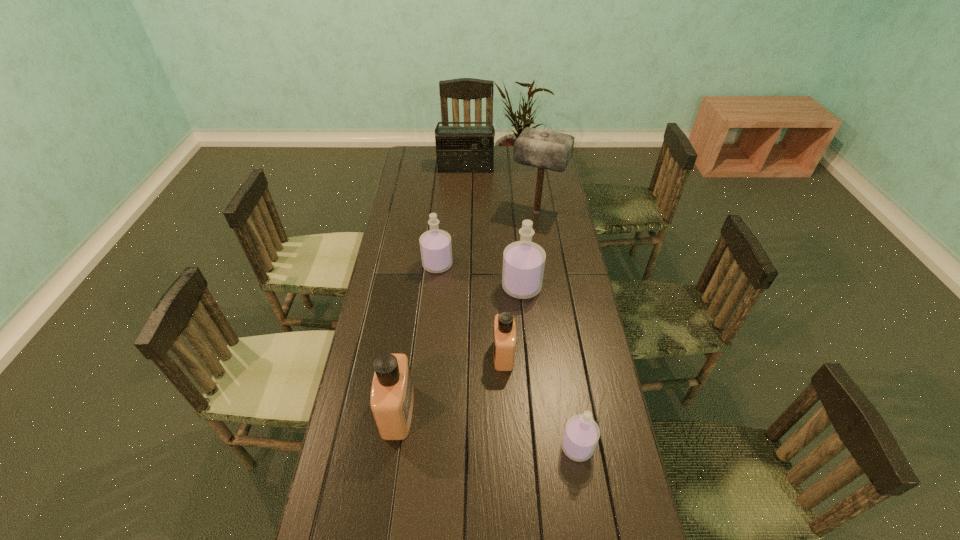
This screenshot has height=540, width=960. I want to click on the farthest object, so click(459, 149).

Locate an element on the screen. radio receiver is located at coordinates (459, 149).

Identify the location of mallet. (543, 149).

I want to click on the tallest perfume, so click(x=523, y=261).

At what (x,y) coordinates should I click in order to perform the action: click on the third tallest object. Please return your answer as a coordinate pair (x, y). The width and height of the screenshot is (960, 540). Looking at the image, I should click on (523, 261).

At what (x,y) coordinates should I click in order to perform the action: click on the leftmost purple perfume. Please return your answer as a coordinate pair (x, y). Looking at the image, I should click on (435, 245).

Locate an element on the screen. This screenshot has height=540, width=960. the nearer beige perfume is located at coordinates (392, 394).

Find the location of a particular element. the left beige perfume is located at coordinates (392, 394).

Image resolution: width=960 pixels, height=540 pixels. What are the coordinates of `the fifth farthest object` in the screenshot? It's located at (504, 344).

The width and height of the screenshot is (960, 540). Find the location of `the third nearest perfume`. the third nearest perfume is located at coordinates (504, 344).